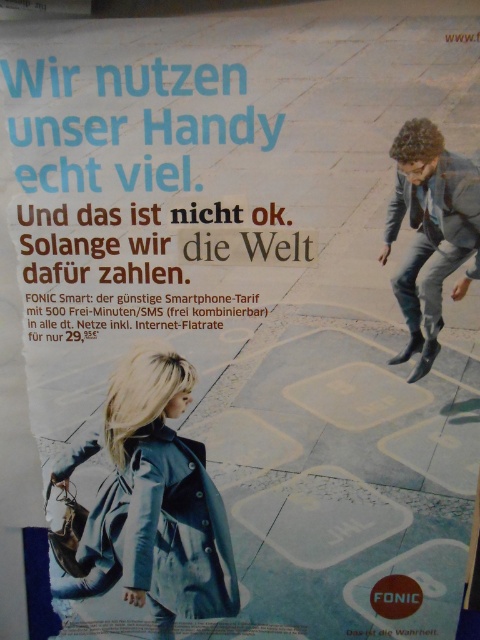
Question: Does matte blue coat at lower left lie in front of gray suit at right?

Choices:
 (A) no
 (B) yes

Answer: (A)

Question: Which point appears closest to the camera in this image?

Choices:
 (A) (440, 291)
 (B) (87, 556)

Answer: (A)

Question: Can you confirm if matte blue coat at lower left is positioned above gray suit at right?

Choices:
 (A) no
 (B) yes

Answer: (A)

Question: Is matte blue coat at lower left positioned in front of gray suit at right?

Choices:
 (A) no
 (B) yes

Answer: (A)